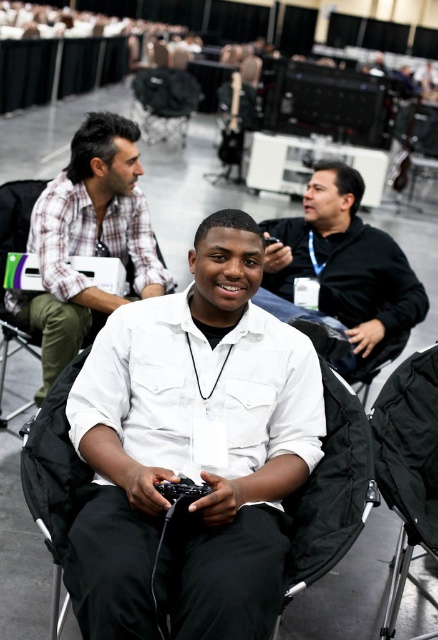
Which is more to the right, white matte shirt at center or black matte shirt at upper right?

black matte shirt at upper right is more to the right.

Consider the image. Between white matte shirt at center and black matte shirt at upper right, which one is positioned higher?

black matte shirt at upper right is higher up.

Image resolution: width=438 pixels, height=640 pixels. Describe the element at coordinates (193, 451) in the screenshot. I see `white matte shirt at center` at that location.

You are a GUI agent. You are given a task and a screenshot of the screen. Output one action in this format:
    pyautogui.click(x=<x>, y=<y>)
    Task: Click on the white matte shirt at center
    This screenshot has width=438, height=640.
    Given the screenshot: What is the action you would take?
    pyautogui.click(x=193, y=451)

Does point (113, 184) come farther from viewer compared to point (389, 384)?

Yes, point (113, 184) is behind point (389, 384).

In the scene shown: Which is more to the right, white plaid shirt at upper left or black fabric chair at lower right?

black fabric chair at lower right

Who is more distant from viewer, [59,288] or [402,385]?

Positioned behind is point [59,288].

At what (x,y) coordinates should I click in order to perform the action: click on white plaid shirt at upper left. Please return your answer as a coordinate pair (x, y). The height and width of the screenshot is (640, 438). Looking at the image, I should click on (88, 240).

Is black matte shirt at upper right shorter than black fabric chair at lower right?

Indeed, black matte shirt at upper right has a lesser height compared to black fabric chair at lower right.

Can you confirm if black matte shirt at upper right is positioned below black fabric chair at lower right?

No, black matte shirt at upper right is not below black fabric chair at lower right.

Locate an element on the screen. The width and height of the screenshot is (438, 640). black matte shirt at upper right is located at coordinates (345, 260).

Find the location of a particular element. black matte shirt at upper right is located at coordinates (345, 260).